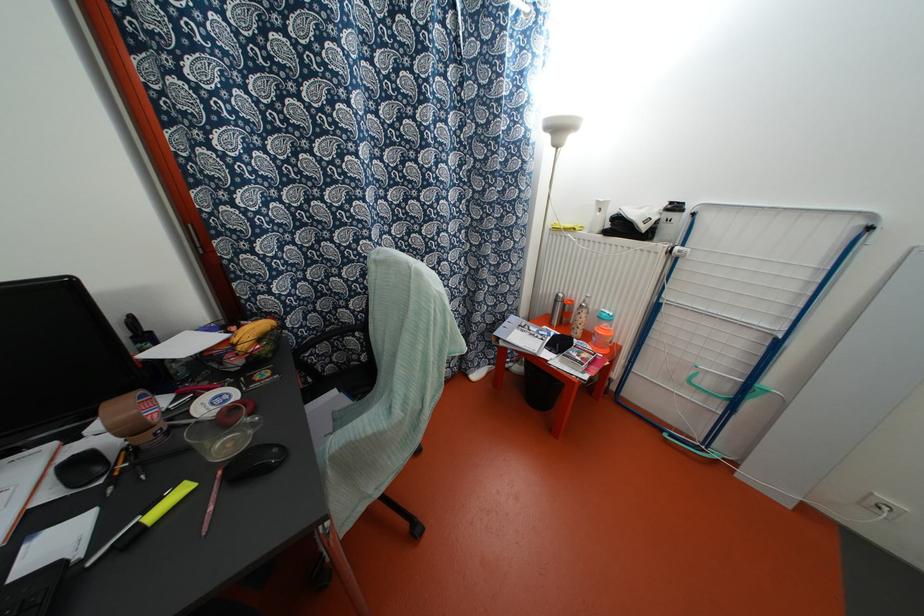
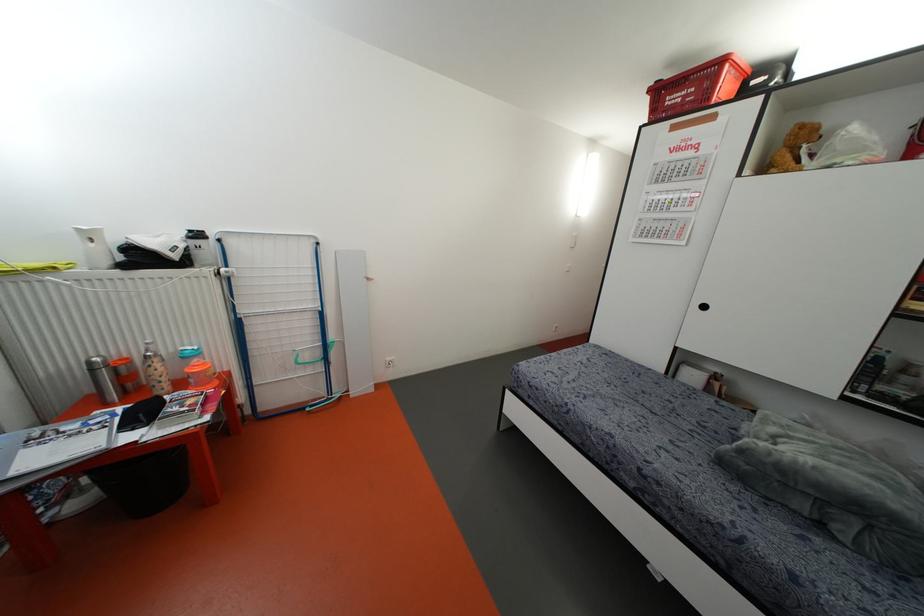
In the second image, find the point that corresponds to (554,301) in the first image.

(91, 370)